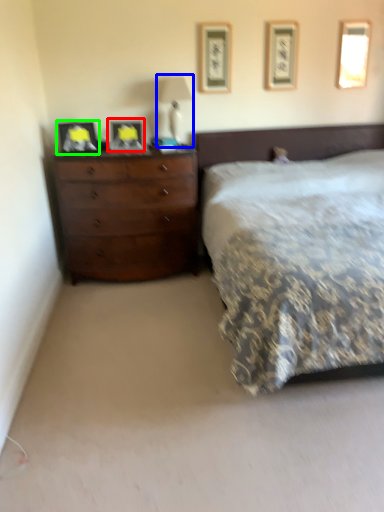
Question: Which object is positioned closest to picture frame (highlighted by a red box)? Select from bedside lamp (highlighted by a blue box) and picture frame (highlighted by a green box).

Choices:
 (A) bedside lamp
 (B) picture frame

Answer: (B)